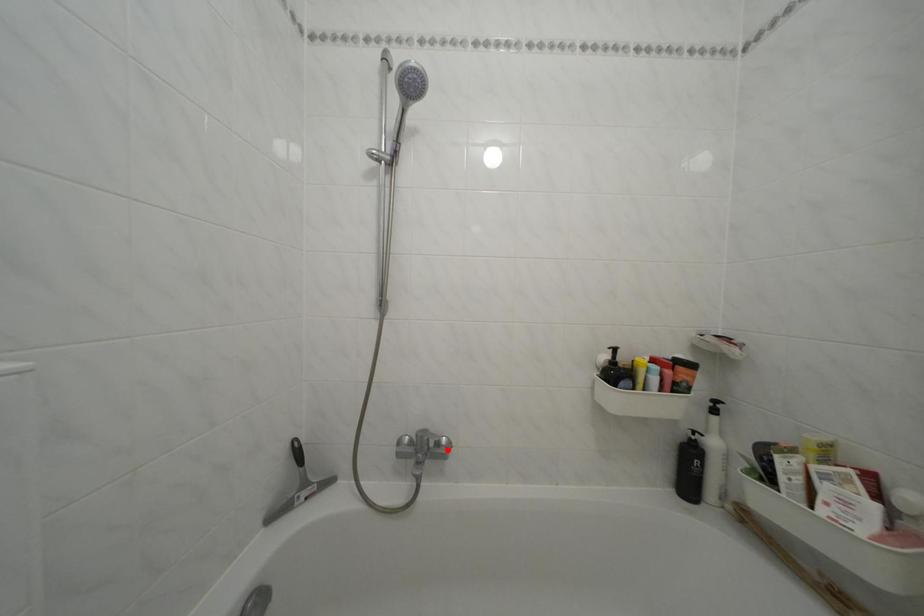
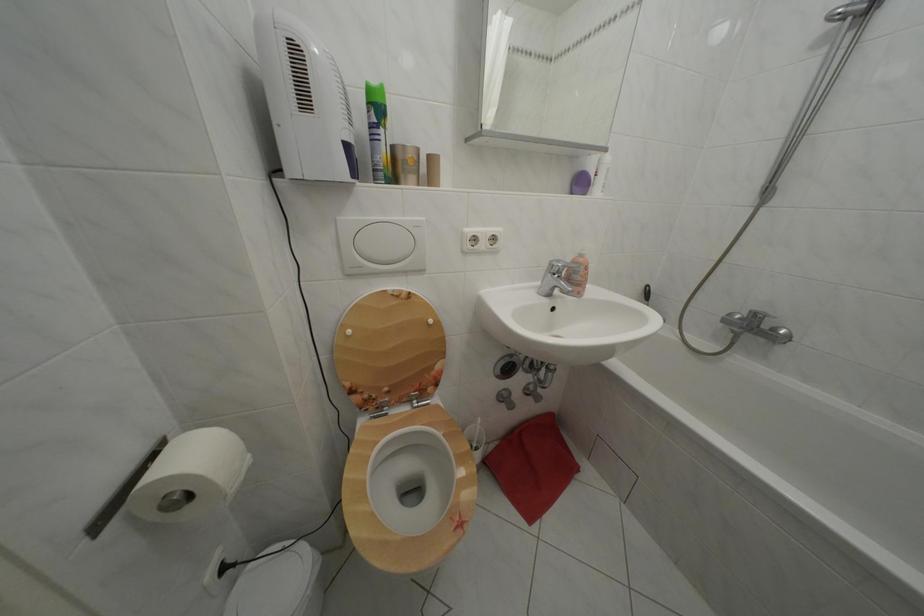
Where in the second image is the point corresponding to the highlighted location from the first image?

(783, 336)